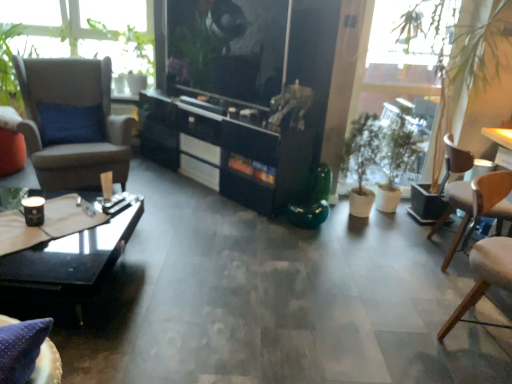
Question: Is wooden table at right closer to camera compared to black glossy cabinet at center?

Choices:
 (A) yes
 (B) no

Answer: (A)

Question: Is black glossy cabinet at center at the back of wooden table at right?

Choices:
 (A) no
 (B) yes

Answer: (A)

Question: From the image's perspective, is wooden table at right beneath black glossy cabinet at center?

Choices:
 (A) yes
 (B) no

Answer: (A)

Question: Would you say wooden table at right contains black glossy cabinet at center?

Choices:
 (A) yes
 (B) no

Answer: (B)

Question: From the image's perspective, is wooden table at right on black glossy cabinet at center?

Choices:
 (A) no
 (B) yes

Answer: (A)

Question: From a real-world perspective, is wooden table at right positioned above or below green matte plant at right?

Choices:
 (A) below
 (B) above

Answer: (A)

Question: Choose the correct answer: Is wooden table at right inside green matte plant at right or outside it?

Choices:
 (A) inside
 (B) outside

Answer: (B)

Question: In the image, is wooden table at right positioned in front of or behind green matte plant at right?

Choices:
 (A) front
 (B) behind

Answer: (B)

Question: Considering the positions of point (486, 130) and point (361, 29), is point (486, 130) closer or farther from the camera than point (361, 29)?

Choices:
 (A) farther
 (B) closer

Answer: (A)

Question: From the image's perspective, is black glossy cabinet at center positioned above or below green matte plant at right?

Choices:
 (A) above
 (B) below

Answer: (A)

Question: In terms of width, does black glossy cabinet at center look wider or thinner when compared to green matte plant at right?

Choices:
 (A) thin
 (B) wide

Answer: (B)

Question: Based on their positions, is black glossy cabinet at center located to the left or right of green matte plant at right?

Choices:
 (A) left
 (B) right

Answer: (A)

Question: Considering the positions of black glossy cabinet at center and green matte plant at right in the image, is black glossy cabinet at center bigger or smaller than green matte plant at right?

Choices:
 (A) big
 (B) small

Answer: (A)

Question: From a real-world perspective, is black glass coffee table at lower left physically located above or below green matte plant at right?

Choices:
 (A) above
 (B) below

Answer: (B)

Question: Based on their positions, is black glass coffee table at lower left located to the left or right of green matte plant at right?

Choices:
 (A) right
 (B) left

Answer: (B)